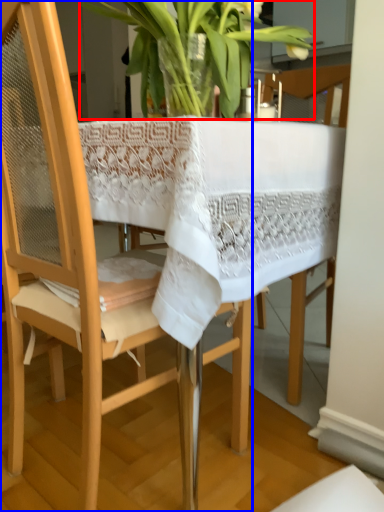
Question: Among these objects, which one is farthest to the camera, houseplant (highlighted by a red box) or chair (highlighted by a blue box)?

Choices:
 (A) houseplant
 (B) chair

Answer: (A)